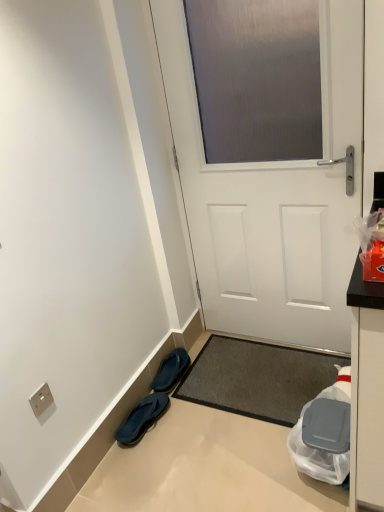
Describe the element at coordinates (142, 418) in the screenshot. The height and width of the screenshot is (512, 384). I see `blue rubber flip-flops at lower left, the 1th footwear viewed from the front` at that location.

Measure the distance between point (170, 358) and camera.

Point (170, 358) and camera are 7.24 feet apart.

This screenshot has width=384, height=512. I want to click on silver metallic electric outlet at lower left, so (x=41, y=400).

What are the coordinates of `blue rubber flip-flops at lower left, which is the 2th footwear in back-to-front order` in the screenshot? It's located at (142, 418).

Which of these two, blue rubber flip-flops at lower left, arranged as the first footwear when viewed from the back, or blue rubber flip-flops at lower left, the 1th footwear viewed from the front, is smaller?

With smaller size is blue rubber flip-flops at lower left, arranged as the first footwear when viewed from the back.

Are blue rubber flip-flops at lower left, arranged as the first footwear when viewed from the back, and blue rubber flip-flops at lower left, the 1th footwear viewed from the front, far apart?

No, blue rubber flip-flops at lower left, arranged as the first footwear when viewed from the back, is not far away from blue rubber flip-flops at lower left, the 1th footwear viewed from the front.

Is point (199, 199) positioned behind point (135, 428)?

Yes, it is behind point (135, 428).

Can you confirm if white matte door at center is positioned to the right of blue rubber flip-flops at lower left, the 1th footwear viewed from the front?

Yes.

From a real-world perspective, who is located lower, white matte door at center or blue rubber flip-flops at lower left, the 1th footwear viewed from the front?

From a 3D spatial view, blue rubber flip-flops at lower left, the 1th footwear viewed from the front, is below.

Locate an element on the screen. Image resolution: width=384 pixels, height=512 pixels. the 2nd footwear below when counting from the white matte door at center (from the image's perspective) is located at coordinates (142, 418).

Considering the relative sizes of silver metallic electric outlet at lower left and blue rubber flip-flops at lower left, the 1th footwear viewed from the front, in the image provided, is silver metallic electric outlet at lower left taller than blue rubber flip-flops at lower left, the 1th footwear viewed from the front,?

Yes.

Considering the sizes of objects silver metallic electric outlet at lower left and blue rubber flip-flops at lower left, the 1th footwear viewed from the front, in the image provided, who is wider, silver metallic electric outlet at lower left or blue rubber flip-flops at lower left, the 1th footwear viewed from the front,?

blue rubber flip-flops at lower left, the 1th footwear viewed from the front.

Is silver metallic electric outlet at lower left not within blue rubber flip-flops at lower left, which is the 2th footwear in back-to-front order?

Absolutely, silver metallic electric outlet at lower left is external to blue rubber flip-flops at lower left, which is the 2th footwear in back-to-front order.

From the image's perspective, which one is positioned lower, silver metallic electric outlet at lower left or blue rubber flip-flops at lower left, which is the 2th footwear in back-to-front order?

blue rubber flip-flops at lower left, which is the 2th footwear in back-to-front order.

Is blue rubber flip-flops at lower left, the 1th footwear viewed from the front, oriented away from dark gray textured mat at center?

That's not correct — blue rubber flip-flops at lower left, the 1th footwear viewed from the front, is not looking away from dark gray textured mat at center.

Does blue rubber flip-flops at lower left, the 1th footwear viewed from the front, lie behind dark gray textured mat at center?

Yes, blue rubber flip-flops at lower left, the 1th footwear viewed from the front, is further from the viewer.

How far apart are blue rubber flip-flops at lower left, the 1th footwear viewed from the front, and dark gray textured mat at center?

16.16 inches.

You are a GUI agent. You are given a task and a screenshot of the screen. Output one action in this format:
    pyautogui.click(x=<x>, y=<y>)
    Task: Click on the 1st footwear positioned above the dark gray textured mat at center (from a real-world perspective)
    The image size is (384, 512).
    Given the screenshot: What is the action you would take?
    pyautogui.click(x=142, y=418)

Is silver metallic electric outlet at lower left inside dark gray textured mat at center?

That's incorrect, silver metallic electric outlet at lower left is not inside dark gray textured mat at center.

Between dark gray textured mat at center and silver metallic electric outlet at lower left, which one has larger size?

With larger size is dark gray textured mat at center.

Is dark gray textured mat at center in front of or behind silver metallic electric outlet at lower left in the image?

dark gray textured mat at center is positioned farther from the viewer than silver metallic electric outlet at lower left.

Does white matte door at center have a lesser height compared to dark gray textured mat at center?

Incorrect, the height of white matte door at center does not fall short of that of dark gray textured mat at center.

Looking at their sizes, would you say white matte door at center is wider or thinner than dark gray textured mat at center?

Considering their sizes, white matte door at center looks slimmer than dark gray textured mat at center.

Considering the positions of point (167, 41) and point (206, 347), is point (167, 41) closer or farther from the camera than point (206, 347)?

Point (167, 41) is closer to the camera than point (206, 347).

From the picture: Can you confirm if white matte door at center is positioned to the right of dark gray textured mat at center?

No, white matte door at center is not to the right of dark gray textured mat at center.

From a real-world perspective, is white matte door at center physically located above or below blue rubber flip-flops at lower left, the second footwear in the front-to-back sequence?

Clearly, from a real-world perspective, white matte door at center is above blue rubber flip-flops at lower left, the second footwear in the front-to-back sequence.

In terms of height, does white matte door at center look taller or shorter compared to blue rubber flip-flops at lower left, the second footwear in the front-to-back sequence?

Clearly, white matte door at center is taller compared to blue rubber flip-flops at lower left, the second footwear in the front-to-back sequence.

From the picture: Which is more to the left, white matte door at center or blue rubber flip-flops at lower left, arranged as the first footwear when viewed from the back?

blue rubber flip-flops at lower left, arranged as the first footwear when viewed from the back, is more to the left.

Who is more distant, white matte door at center or blue rubber flip-flops at lower left, arranged as the first footwear when viewed from the back?

blue rubber flip-flops at lower left, arranged as the first footwear when viewed from the back, is further from the camera.

The width and height of the screenshot is (384, 512). Identify the location of footwear below the blue rubber flip-flops at lower left, arranged as the first footwear when viewed from the back (from a real-world perspective). (142, 418).

The width and height of the screenshot is (384, 512). What are the coordinates of `the 1st footwear behind the white matte door at center` in the screenshot? It's located at (142, 418).

Which object lies further to the anchor point white matte door at center, silver metallic electric outlet at lower left or dark gray textured mat at center?

Based on the image, silver metallic electric outlet at lower left appears to be further to white matte door at center.

When comparing their distances from blue rubber flip-flops at lower left, which is the 2th footwear in back-to-front order, does silver metallic electric outlet at lower left or white matte door at center seem further?

white matte door at center is further to blue rubber flip-flops at lower left, which is the 2th footwear in back-to-front order.

Considering their positions, is blue rubber flip-flops at lower left, the 1th footwear viewed from the front, positioned further to silver metallic electric outlet at lower left than white matte door at center?

Based on the image, white matte door at center appears to be further to silver metallic electric outlet at lower left.

From the image, which object appears to be nearer to silver metallic electric outlet at lower left, white matte door at center or dark gray textured mat at center?

dark gray textured mat at center.

Estimate the real-world distances between objects in this image. Which object is closer to blue rubber flip-flops at lower left, arranged as the first footwear when viewed from the back, blue rubber flip-flops at lower left, the 1th footwear viewed from the front, or silver metallic electric outlet at lower left?

Among the two, blue rubber flip-flops at lower left, the 1th footwear viewed from the front, is located nearer to blue rubber flip-flops at lower left, arranged as the first footwear when viewed from the back.

Considering their positions, is blue rubber flip-flops at lower left, the 1th footwear viewed from the front, positioned closer to blue rubber flip-flops at lower left, the second footwear in the front-to-back sequence, than white matte door at center?

blue rubber flip-flops at lower left, the 1th footwear viewed from the front.

Looking at the image, which one is located further to blue rubber flip-flops at lower left, the second footwear in the front-to-back sequence, white matte door at center or dark gray textured mat at center?

white matte door at center is positioned further to the anchor blue rubber flip-flops at lower left, the second footwear in the front-to-back sequence.

Looking at the image, which one is located further to blue rubber flip-flops at lower left, which is the 2th footwear in back-to-front order, blue rubber flip-flops at lower left, arranged as the first footwear when viewed from the back, or silver metallic electric outlet at lower left?

Based on the image, silver metallic electric outlet at lower left appears to be further to blue rubber flip-flops at lower left, which is the 2th footwear in back-to-front order.

Locate an element on the screen. The width and height of the screenshot is (384, 512). doormat between white matte door at center and blue rubber flip-flops at lower left, the 1th footwear viewed from the front, in the up-down direction is located at coordinates (257, 378).

Find the location of a particular element. footwear between white matte door at center and blue rubber flip-flops at lower left, which is the 2th footwear in back-to-front order, in the up-down direction is located at coordinates (171, 370).

Identify the location of footwear positioned between silver metallic electric outlet at lower left and blue rubber flip-flops at lower left, arranged as the first footwear when viewed from the back, from near to far. The width and height of the screenshot is (384, 512). (142, 418).

This screenshot has height=512, width=384. In order to click on door between silver metallic electric outlet at lower left and dark gray textured mat at center in this screenshot , I will do `click(273, 198)`.